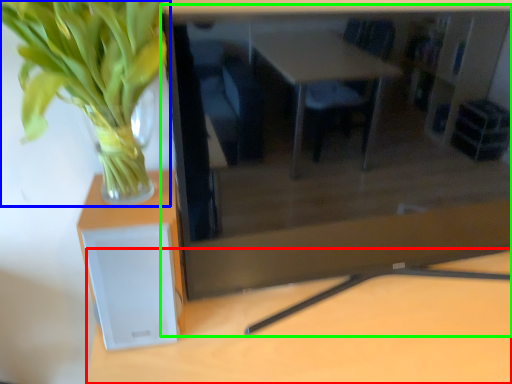
Question: Based on their relative distances, which object is nearer to table (highlighted by a red box)? Choose from houseplant (highlighted by a blue box) and computer desk (highlighted by a green box).

Choices:
 (A) houseplant
 (B) computer desk

Answer: (B)